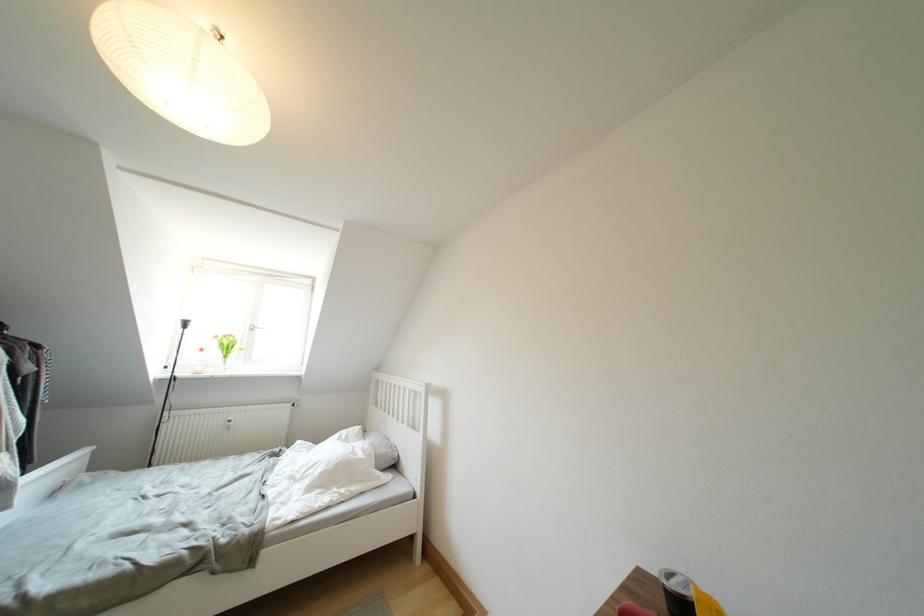
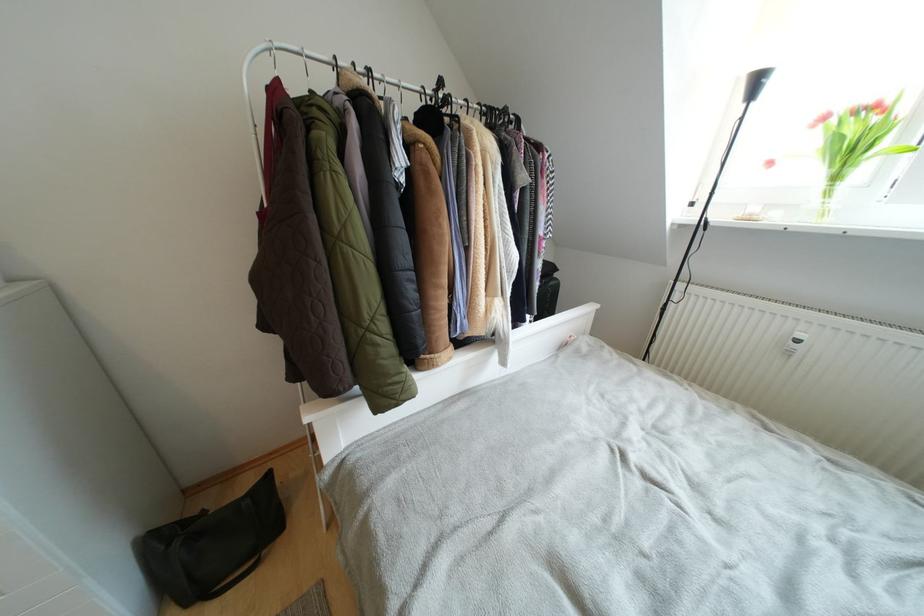
Locate, in the second image, the point that corresponds to the point at 231,361 in the first image.

(840, 182)